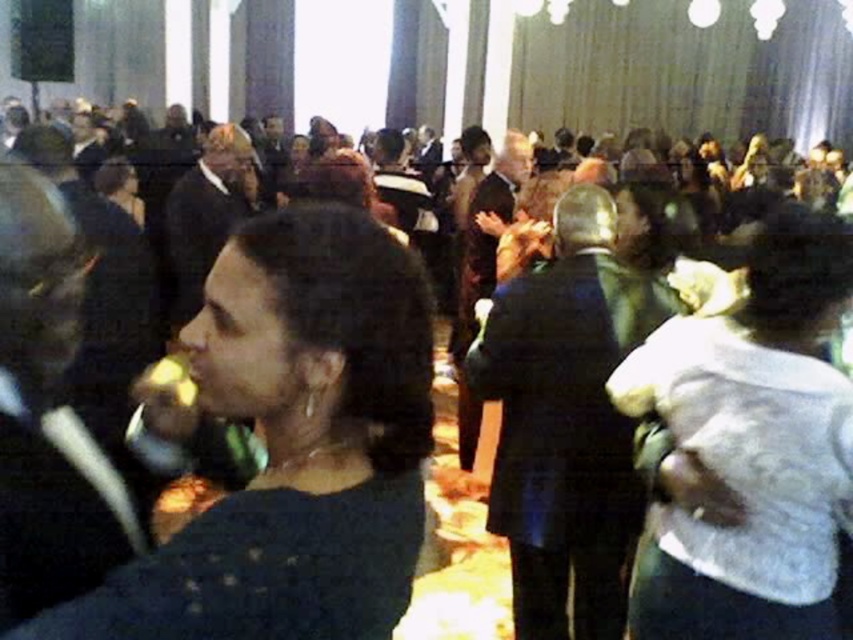
Between dark blue sweater at center and white fabric purse at center, which one has less height?

dark blue sweater at center

Between dark blue sweater at center and white fabric purse at center, which one appears on the left side from the viewer's perspective?

From the viewer's perspective, dark blue sweater at center appears more on the left side.

Locate an element on the screen. This screenshot has width=853, height=640. dark blue sweater at center is located at coordinates (294, 445).

Identify the location of dark blue sweater at center. Image resolution: width=853 pixels, height=640 pixels. (294, 445).